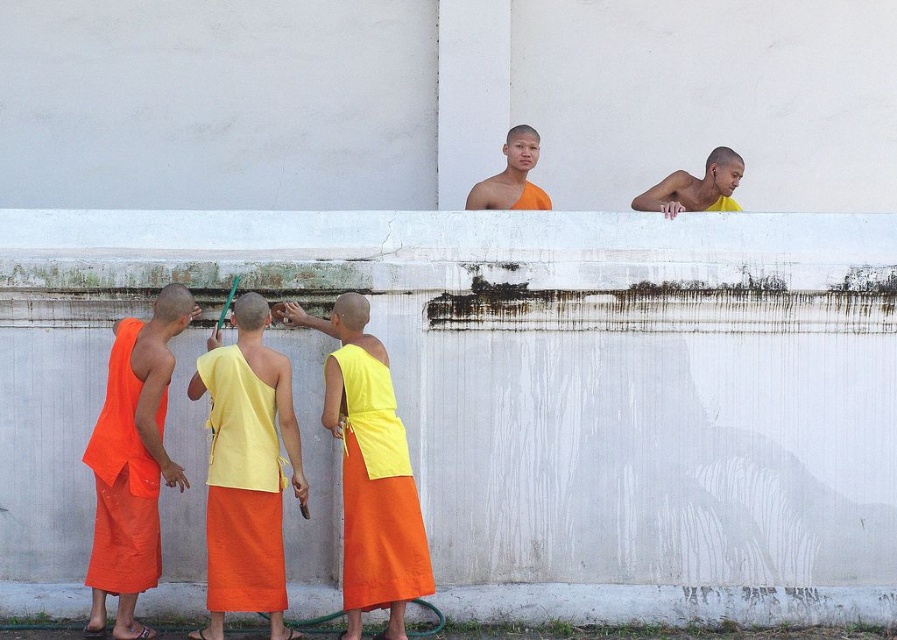
You are standing in front of the large white wall and see the yellow matte cloth at center and the orange cloth monk at upper center. Which object is positioned higher?

The orange cloth monk at upper center is positioned higher than the yellow matte cloth at center.

You are standing in front of the wall and want to hand a tool to both the yellow cotton robe at center and the yellow matte monk at upper center. Which one should you hand the tool to first based on their height?

The yellow cotton robe at center is much taller than the yellow matte monk at upper center, so you should hand the tool to the yellow cotton robe at center first.